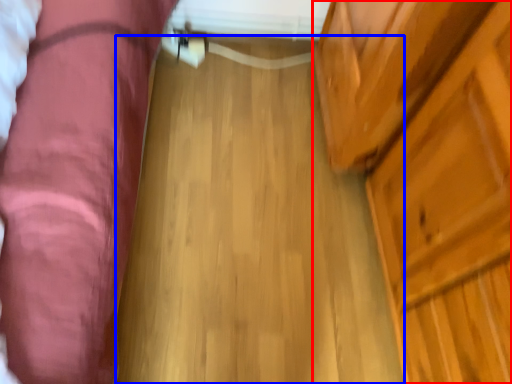
Question: Which object is further to the camera taking this photo, dresser (highlighted by a red box) or plank (highlighted by a blue box)?

Choices:
 (A) dresser
 (B) plank

Answer: (B)